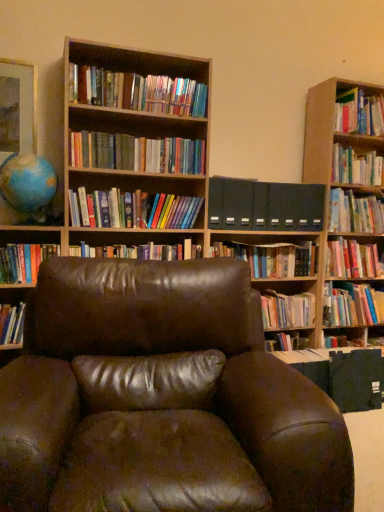
Question: Considering their positions, is hardcover books at center, acting as the 7th book starting from the top, located in front of or behind hardcover book at left, which is the 2th book in bottom-to-top order?

Choices:
 (A) behind
 (B) front

Answer: (A)

Question: Is hardcover books at center, marked as the 7th book in a bottom-to-top arrangement, spatially inside hardcover book at left, the twelfth book in the top-to-bottom sequence, or outside of it?

Choices:
 (A) inside
 (B) outside

Answer: (B)

Question: Based on their relative distances, which object is farther from the hardcover books at center, the tenth book from the bottom?

Choices:
 (A) hardcover books at upper center, arranged as the second book when viewed from the top
 (B) brown wooden bookcase at upper center
 (C) hardcover books at center, placed as the 8th book when sorted from bottom to top
 (D) hardcover book at upper right, acting as the 5th book starting from the top
 (E) matte gold picture frame at upper left

Answer: (D)

Question: Which of these objects is positioned farthest from the matte gold picture frame at upper left?

Choices:
 (A) brown wooden bookcase at upper center
 (B) hardcover book at center, positioned as the 3th book in bottom-to-top order
 (C) hardcover book at right, the sixth book in the bottom-to-top sequence
 (D) dark gray matte folder at center
 (E) hardcover book at upper right, the 9th book when ordered from bottom to top

Answer: (B)